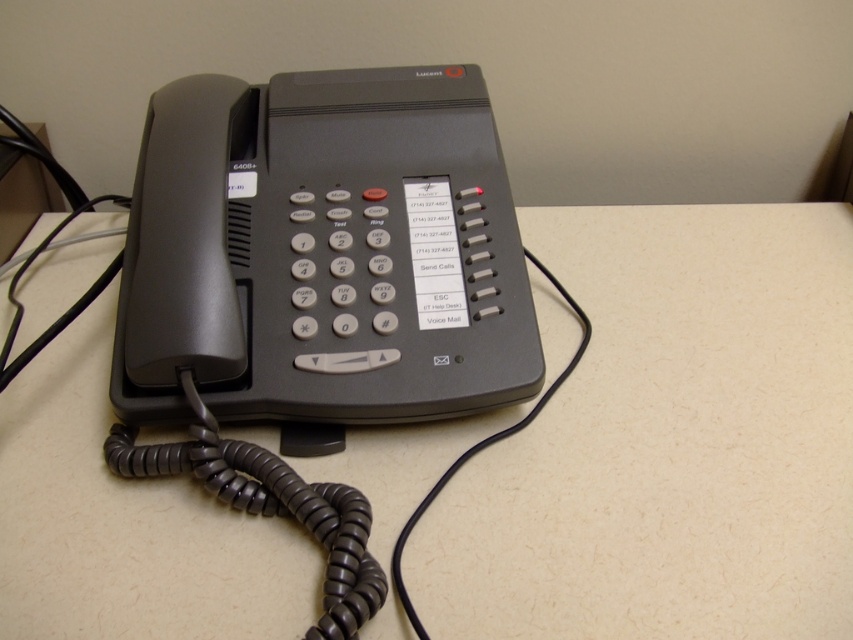
Between beige matte table at center and matte black telephone at center, which one is positioned lower?

Positioned lower is beige matte table at center.

Find the location of a particular element. The width and height of the screenshot is (853, 640). beige matte table at center is located at coordinates (668, 442).